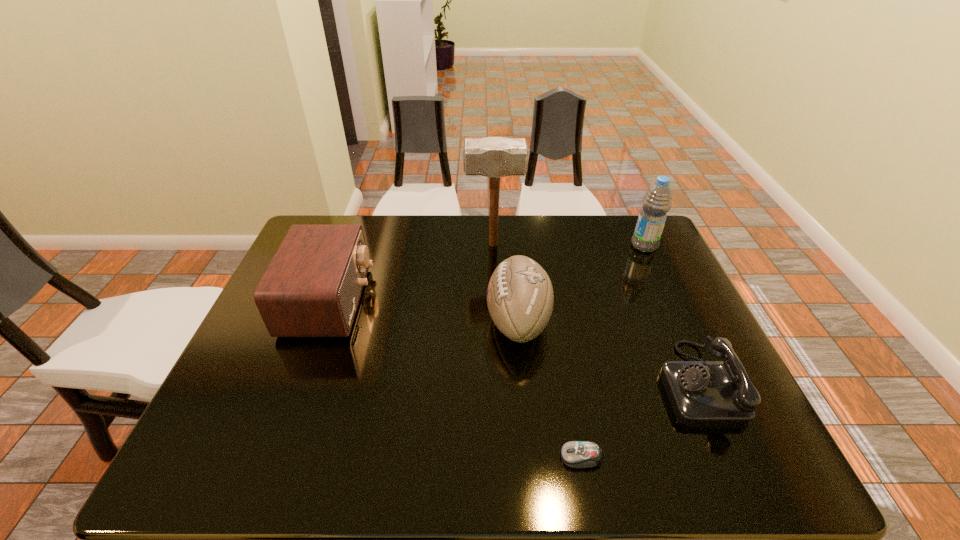
Where is `blank space at the left edge of the desktop`? blank space at the left edge of the desktop is located at coordinates (260, 342).

In the image, there is a desktop. At what (x,y) coordinates should I click in order to perform the action: click on free space at the right edge. Please return your answer as a coordinate pair (x, y). The height and width of the screenshot is (540, 960). Looking at the image, I should click on (682, 327).

This screenshot has width=960, height=540. Identify the location of free spot at the far left corner of the desktop. (322, 214).

Find the location of a particular element. vacant space at the near left corner of the desktop is located at coordinates (197, 453).

The width and height of the screenshot is (960, 540). In the image, there is a desktop. Find the location of `free space at the near right corner`. free space at the near right corner is located at coordinates (744, 457).

Locate an element on the screen. This screenshot has width=960, height=540. empty location between the radio receiver and the shortest object is located at coordinates (455, 379).

You are a GUI agent. You are given a task and a screenshot of the screen. Output one action in this format:
    pyautogui.click(x=<x>, y=<y>)
    Task: Click on the free space between the fifth tallest object and the fifth shortest object
    The width and height of the screenshot is (960, 540).
    Given the screenshot: What is the action you would take?
    pyautogui.click(x=670, y=314)

What are the coordinates of `vacant area that lies between the water bottle and the leftmost object` in the screenshot? It's located at (487, 274).

You are a GUI agent. You are given a task and a screenshot of the screen. Output one action in this format:
    pyautogui.click(x=<x>, y=<y>)
    Task: Click on the free space between the football (American) and the telephone
    The width and height of the screenshot is (960, 540).
    Given the screenshot: What is the action you would take?
    pyautogui.click(x=608, y=351)

Locate an element on the screen. This screenshot has height=540, width=960. vacant area that lies between the leftmost object and the fifth shortest object is located at coordinates (487, 274).